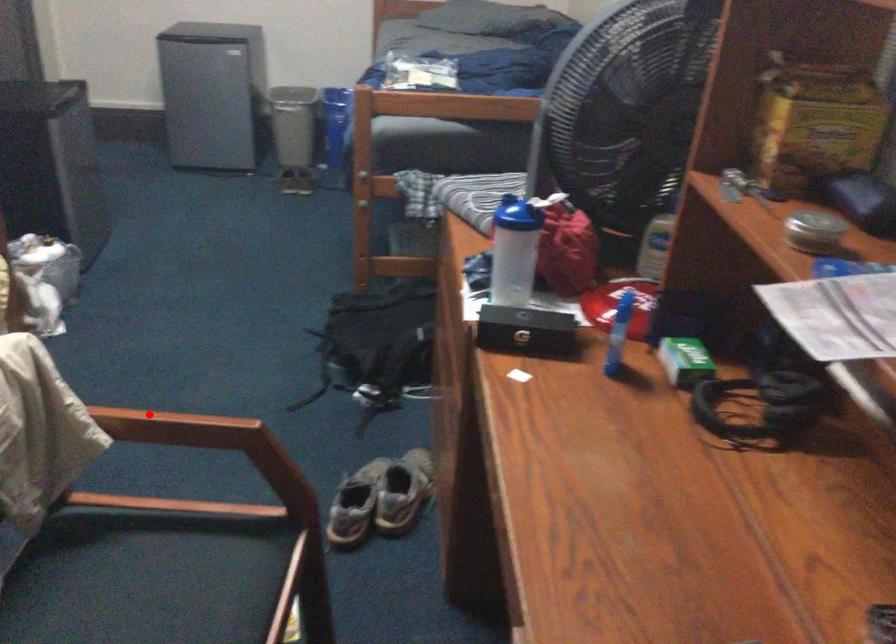
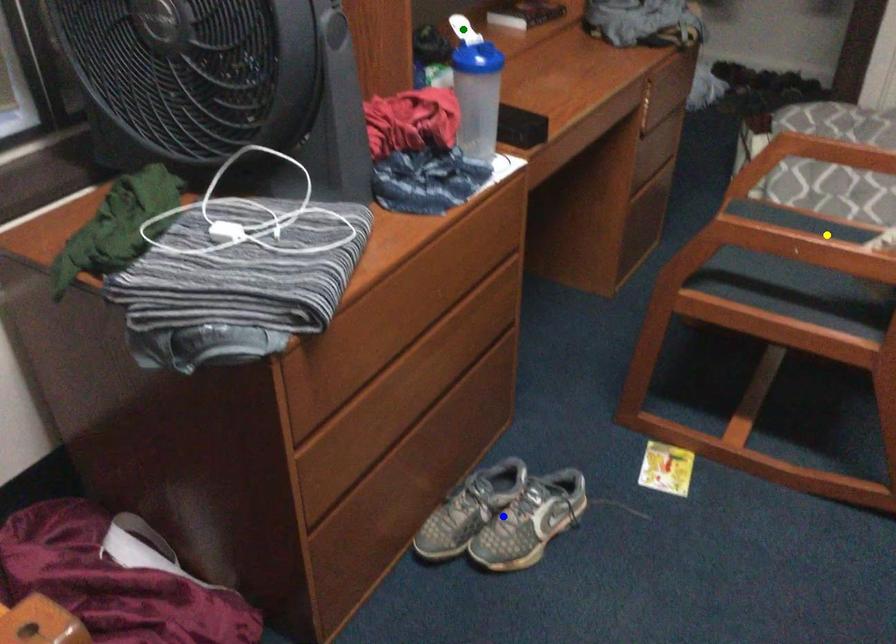
Question: I am providing you with two images of the same scene from different viewpoints. A red point is marked on the first image. You are given multiple points on the second image. Can you choose the point in image 2 that corresponds to the point in image 1?

Choices:
 (A) yellow point
 (B) green point
 (C) blue point

Answer: (A)